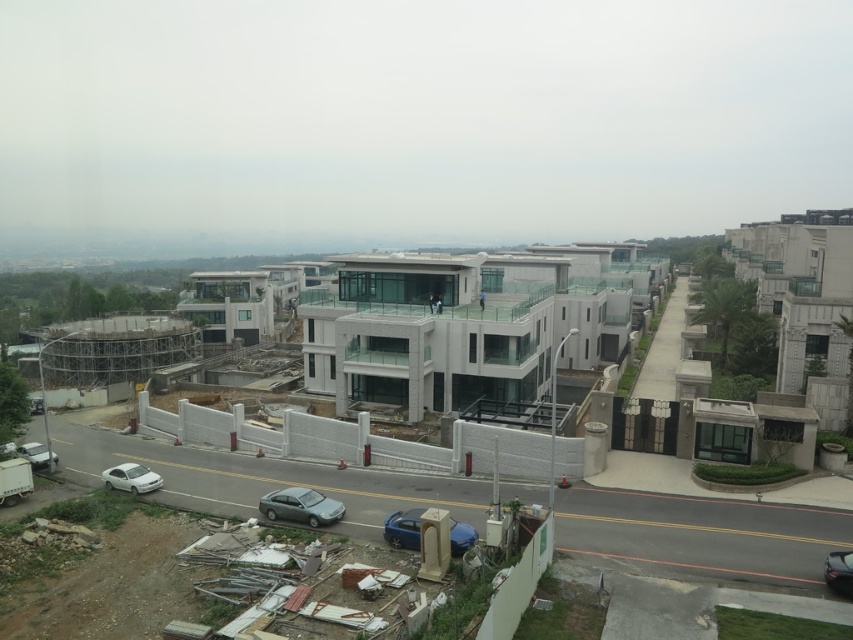
Which is in front, point (834, 580) or point (25, 452)?

Point (834, 580) is in front.

Between shiny black car at lower right and silver metallic car at lower left, which one has less height?

Standing shorter between the two is silver metallic car at lower left.

Where is `shiny black car at lower right`? The height and width of the screenshot is (640, 853). shiny black car at lower right is located at coordinates (838, 572).

At what (x,y) coordinates should I click in order to perform the action: click on shiny black car at lower right. Please return your answer as a coordinate pair (x, y). The image size is (853, 640). Looking at the image, I should click on (838, 572).

Does satin silver sedan at center have a lesser height compared to shiny black car at lower right?

Correct, satin silver sedan at center is not as tall as shiny black car at lower right.

Is point (329, 508) positioned after point (833, 573)?

Yes.

Identify the location of satin silver sedan at center. The width and height of the screenshot is (853, 640). (300, 506).

Can you confirm if satin silver sedan at center is wider than white glossy sedan at lower left?

Indeed, satin silver sedan at center has a greater width compared to white glossy sedan at lower left.

The image size is (853, 640). In order to click on satin silver sedan at center in this screenshot , I will do `click(300, 506)`.

Between point (297, 502) and point (123, 476), which one is positioned in front?

Point (297, 502) is more forward.

Locate an element on the screen. Image resolution: width=853 pixels, height=640 pixels. satin silver sedan at center is located at coordinates (300, 506).